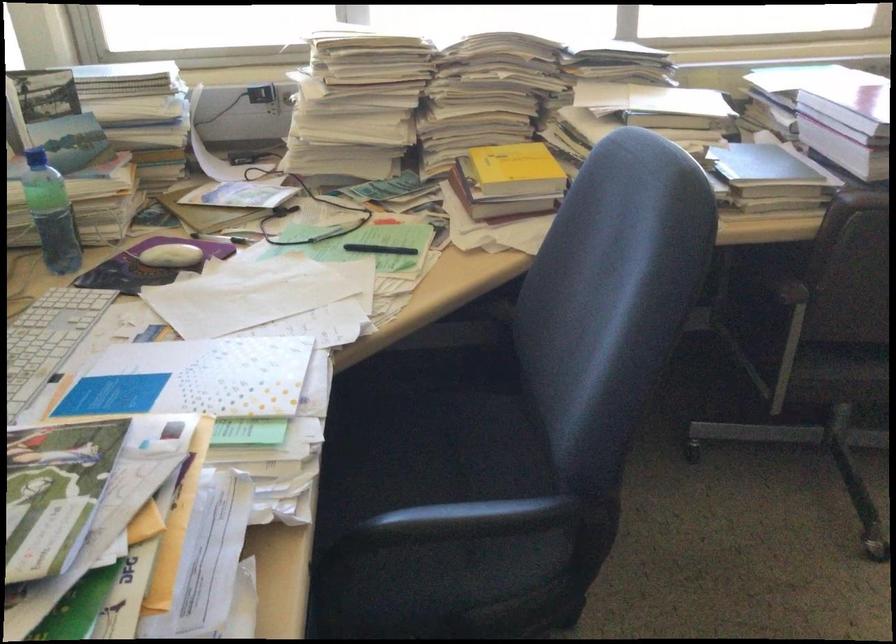
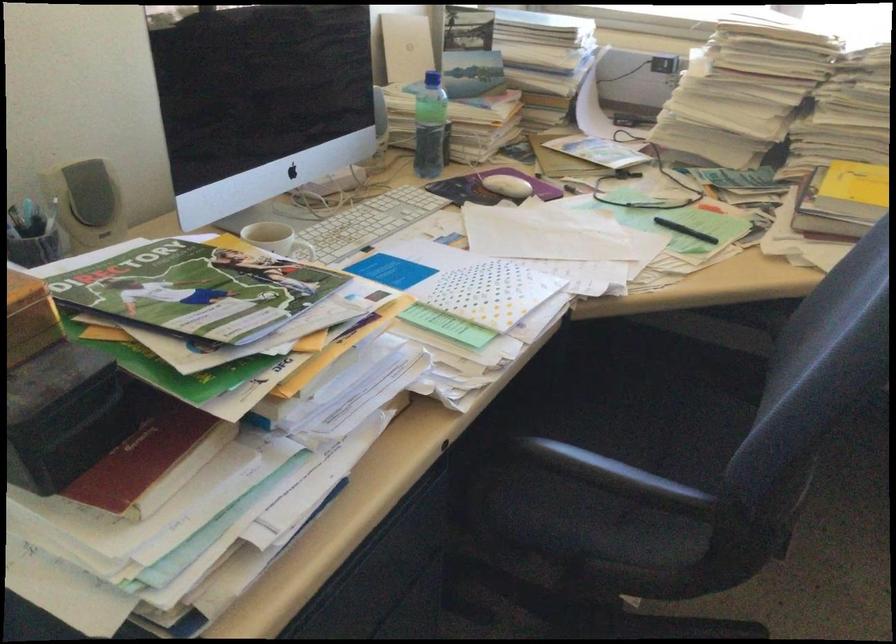
Locate, in the second image, the point that corresponds to [266,205] in the first image.

(610, 166)